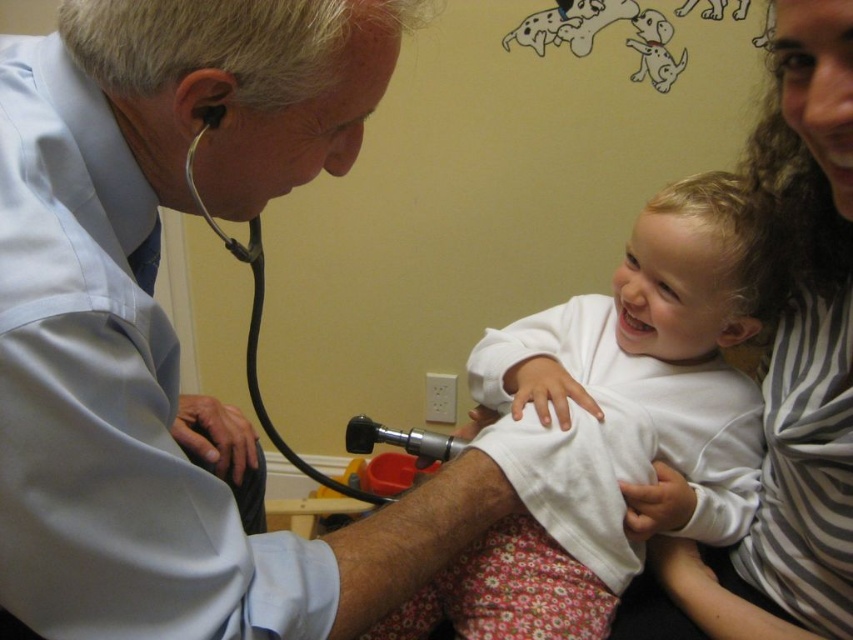
You are a patient in the pediatrician office. You need to reach the metallic black stethoscope at left to hand it to the doctor. Is the striped fabric at upper right blocking your path?

The striped fabric at upper right is closer to the viewer than metallic black stethoscope at left, so it is blocking the path to the metallic black stethoscope at left.

You are a tailor measuring fabrics for a project. You have a piece of striped fabric at upper right and a white matte shirt at center. Which fabric has a greater width?

The white matte shirt at center has a greater width than the striped fabric at upper right according to the description.

You are a nurse in the pediatrician office. You need to place a bandage on the point that is closer to the doctor. Which point should you choose between point [611,388] and point [376,426]?

Point [376,426] is closer to the doctor because it is behind point [611,388]. Since the doctor is likely positioned near the front of the scene, placing the bandage on the point closer to them would be point [376,426].